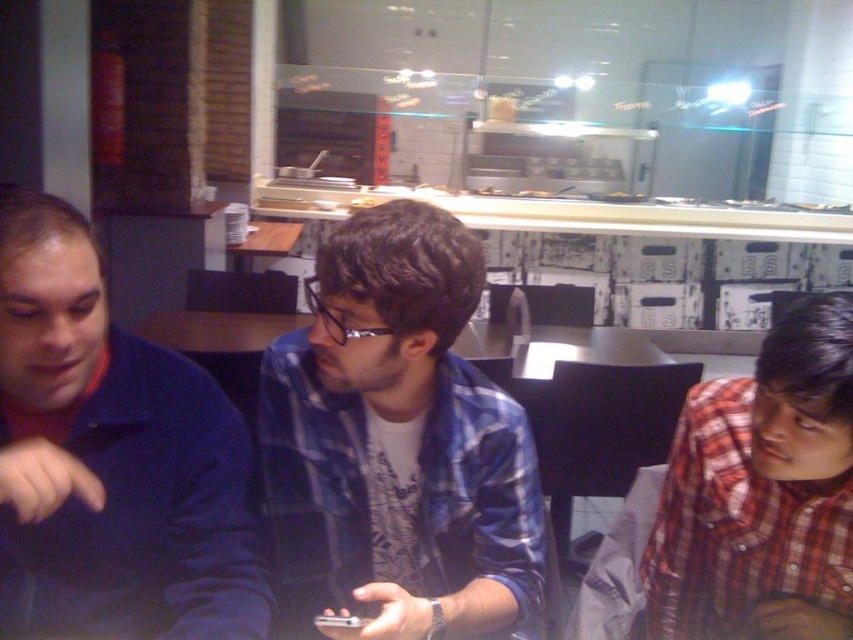
You are a delivery person who needs to place a hot pizza box between the blue plaid shirt at center and the plaid shirt at right. The pizza box is 12 inches wide. Can you fit it between them without moving either shirt?

The distance between the blue plaid shirt at center and the plaid shirt at right is 14.34 inches. Since the pizza box is 12 inches wide, it can fit between them as the space is wider than the box.

You are sitting at the table and want to pass a napkin from the blue plaid shirt at center to the plaid shirt at right. In which direction should you move the napkin?

You should move the napkin to the right, since the blue plaid shirt at center is to the left of the plaid shirt at right.

You are a server in a restaurant and need to deliver a small appetizer plate to the table where the blue cotton shirt at left and plaid shirt at right are seated. The plate is 10 inches wide. Can you place it between them without moving either shirt? Please explain.

The blue cotton shirt at left is 28.25 inches from the plaid shirt at right. Since the plate is 10 inches wide, there is enough space between them to place it without moving either shirt.